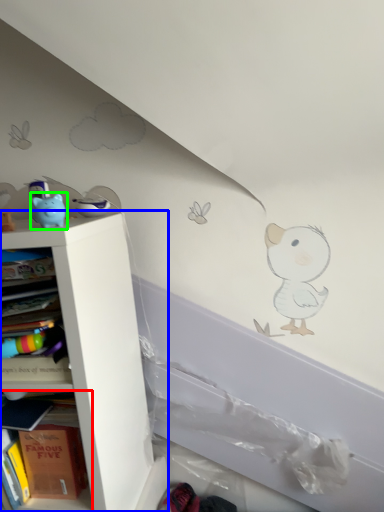
Question: Which object is the farthest from shelf (highlighted by a red box)? Choose among these: shelf (highlighted by a blue box) or toy (highlighted by a green box).

Choices:
 (A) shelf
 (B) toy

Answer: (B)